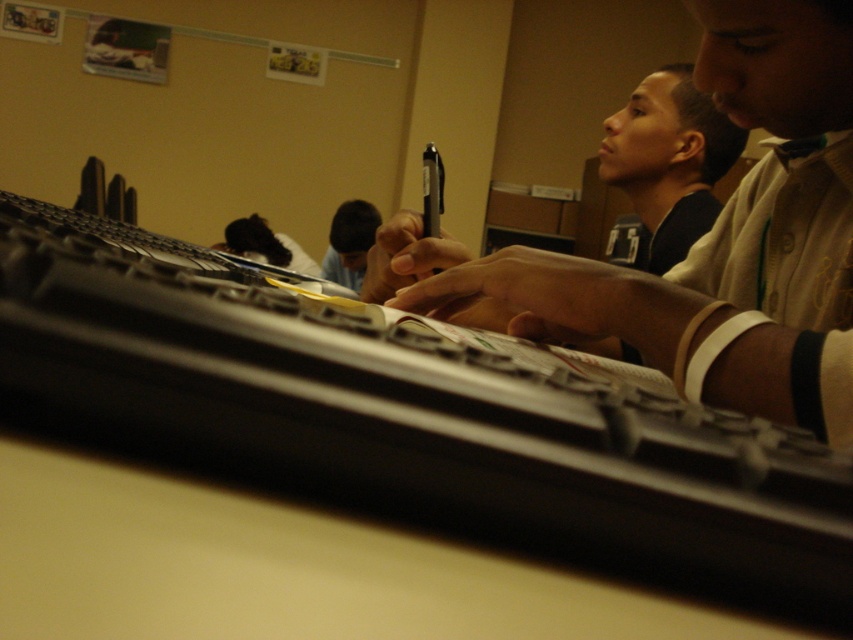
You are trying to locate the black plastic keyboard at center in the classroom. According to the coordinates provided, what are the exact coordinates where you should look to find it?

The black plastic keyboard at center is located at coordinates point (408, 417).

You are a photographer adjusting your camera settings to capture the scene. You notice the matte black shirt at upper center and the smooth black hair at center. Which object would you need to adjust your focus to capture more clearly if you want to emphasize the wider one?

The matte black shirt at upper center has a larger width than the smooth black hair at center, so to emphasize the wider one, you should adjust your focus on the matte black shirt at upper center.

Based on the photo, you are a student trying to reach for the matte black pen at upper center while your hands are on the black plastic keyboard at center. Can you easily access the pen without moving your hands?

The black plastic keyboard at center is positioned under the matte black pen at upper center, so the pen is likely above the keyboard. Since the keyboard is at center and the pen is above it, you can probably reach the matte black pen at upper center without moving your hands much.